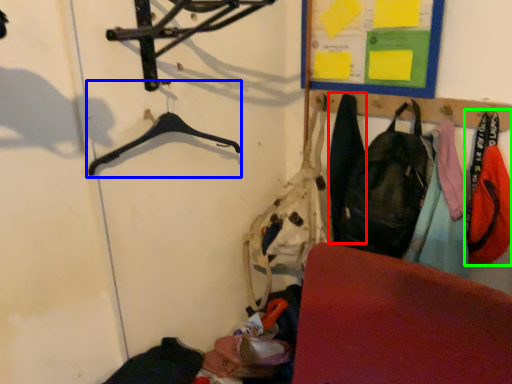
Question: Which object is the farthest from clothing (highlighted by a red box)? Choose among these: hanger (highlighted by a blue box) or clothing (highlighted by a green box).

Choices:
 (A) hanger
 (B) clothing

Answer: (A)